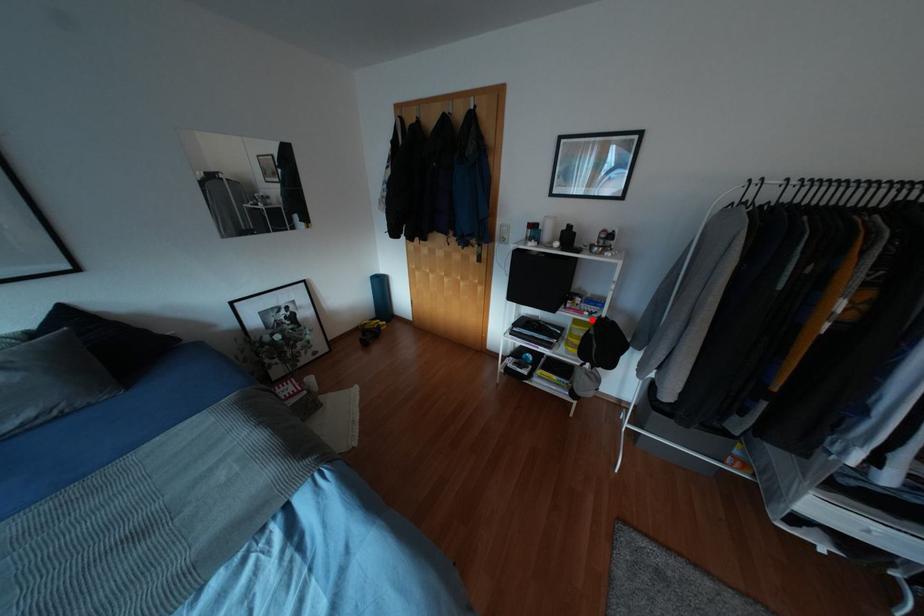
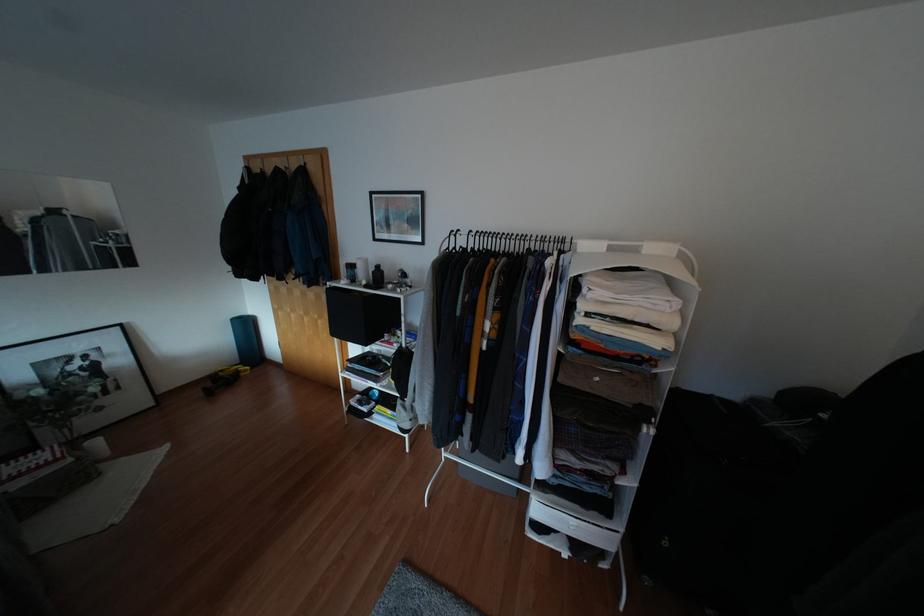
Where in the second image is the point corresponding to the highlighted location from the first image?

(394, 351)